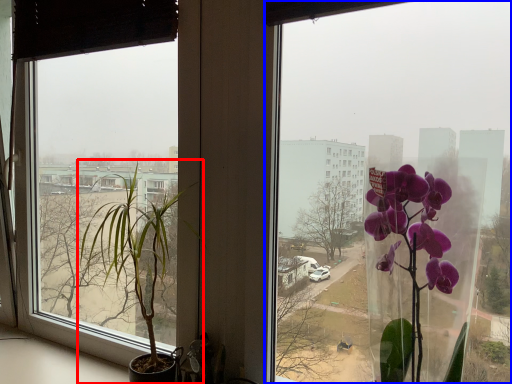
Question: Among these objects, which one is nearest to the camera, houseplant (highlighted by a red box) or window (highlighted by a blue box)?

Choices:
 (A) houseplant
 (B) window

Answer: (B)